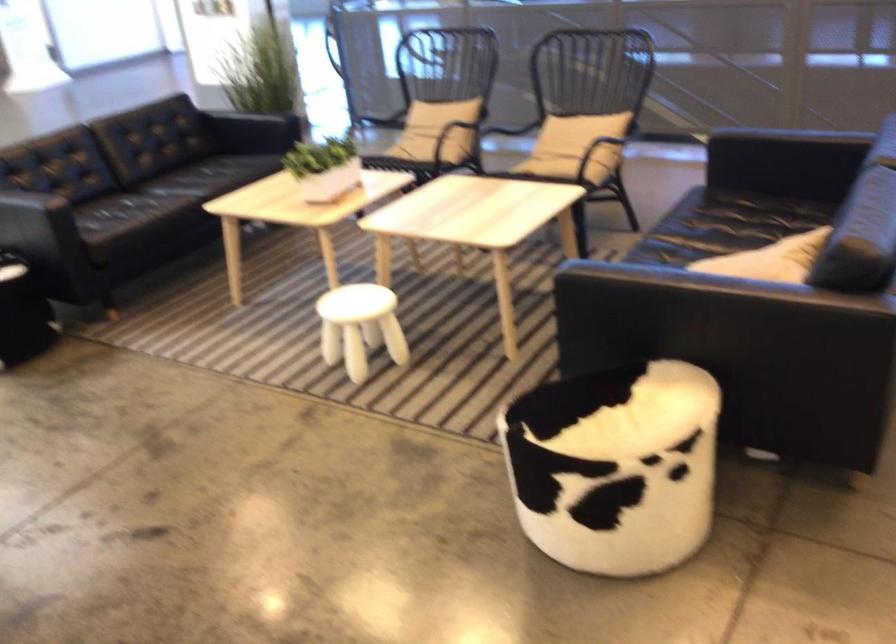
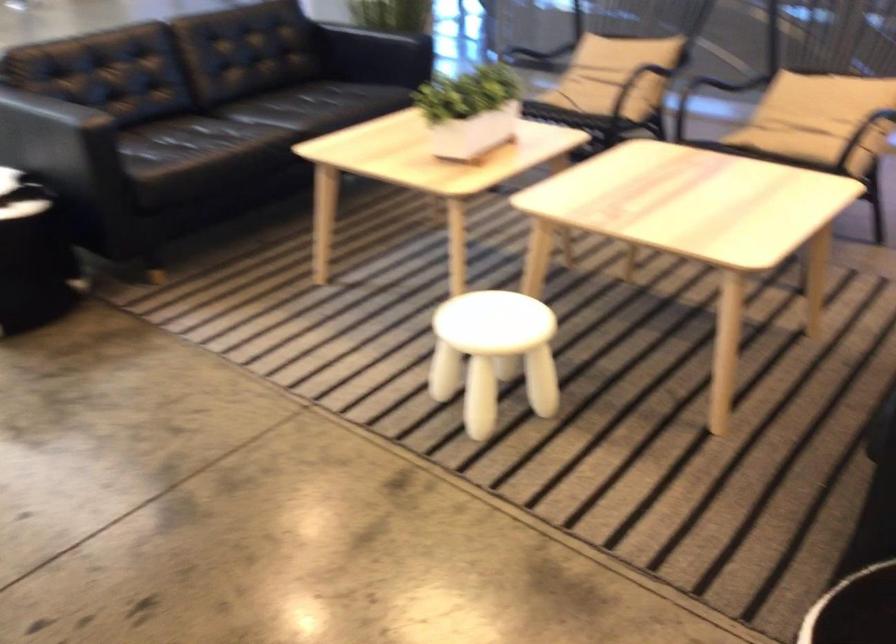
Find the pixel in the second image that matches [323,167] in the first image.

(470, 111)